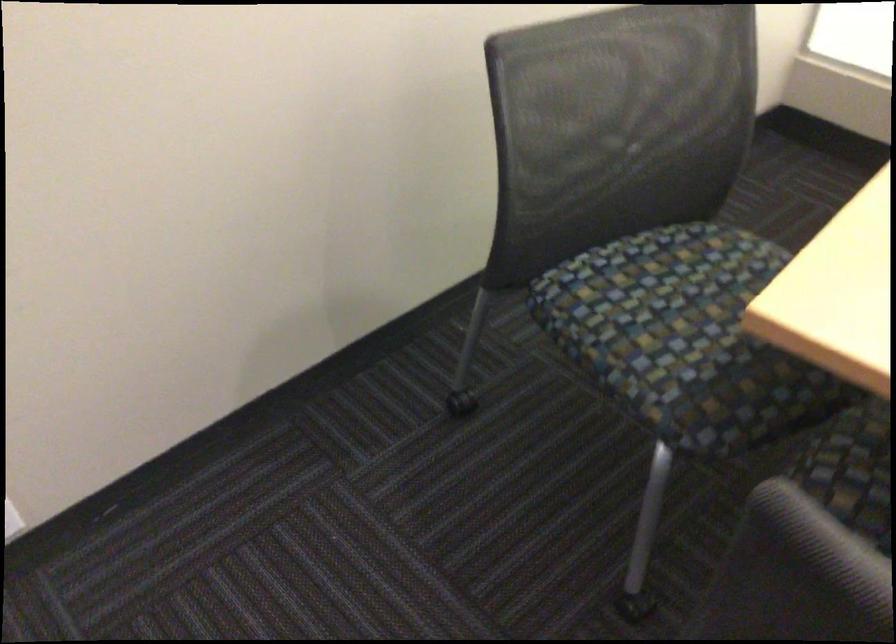
Where is `chair sitting surface`? chair sitting surface is located at coordinates point(685,337).